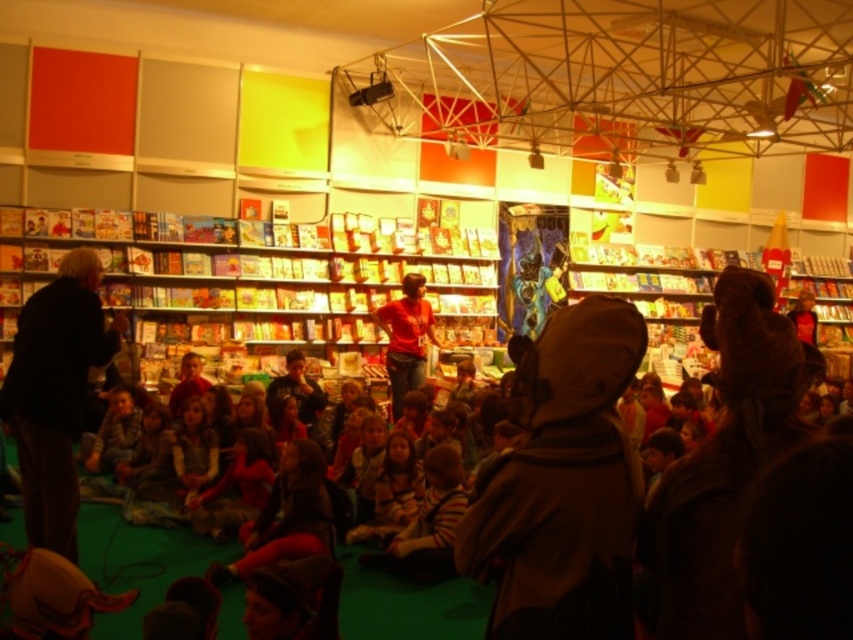
The width and height of the screenshot is (853, 640). I want to click on matte cardboard bookshelf at center, so coord(254,288).

Between matte cardboard bookshelf at center and striped sweater at lower left, which one has more height?

matte cardboard bookshelf at center

Is point (151, 259) farther from viewer compared to point (114, 451)?

Yes, point (151, 259) is behind point (114, 451).

The height and width of the screenshot is (640, 853). What are the coordinates of `matte cardboard bookshelf at center` in the screenshot? It's located at (254, 288).

Is matte red shirt at center shorter than striped sweater at lower left?

Incorrect, matte red shirt at center's height does not fall short of striped sweater at lower left's.

Does point (408, 337) lie in front of point (129, 442)?

That is False.

Does point (421, 296) come farther from viewer compared to point (111, 465)?

That is True.

At what (x,y) coordinates should I click in order to perform the action: click on matte red shirt at center. Please return your answer as a coordinate pair (x, y). Looking at the image, I should click on (405, 337).

Does matte cardboard bookshelf at center appear on the left side of matte red shirt at center?

Yes, matte cardboard bookshelf at center is to the left of matte red shirt at center.

Which is below, matte cardboard bookshelf at center or matte red shirt at center?

matte red shirt at center is below.

At what (x,y) coordinates should I click in order to perform the action: click on matte cardboard bookshelf at center. Please return your answer as a coordinate pair (x, y). The width and height of the screenshot is (853, 640). Looking at the image, I should click on (254, 288).